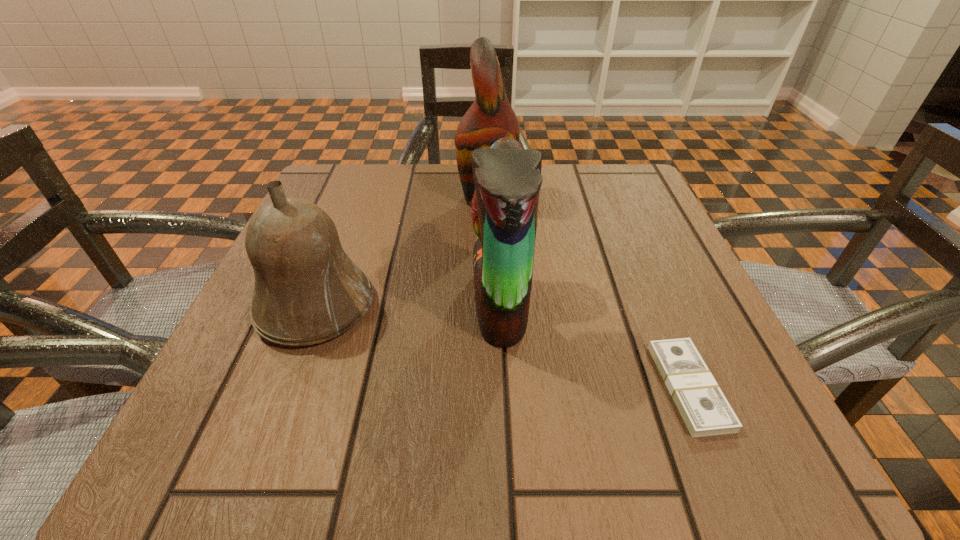
This screenshot has height=540, width=960. I want to click on vacant space that is in between the shorter parrot and the leftmost object, so click(x=408, y=305).

You are a GUI agent. You are given a task and a screenshot of the screen. Output one action in this format:
    pyautogui.click(x=<x>, y=<y>)
    Task: Click on the vacant area that lies between the dollar and the farthest object
    This screenshot has width=960, height=540.
    Given the screenshot: What is the action you would take?
    pyautogui.click(x=589, y=292)

Image resolution: width=960 pixels, height=540 pixels. I want to click on free point between the bell and the farthest object, so click(403, 252).

The width and height of the screenshot is (960, 540). Find the location of `object that is the third closest to the shortest object`. object that is the third closest to the shortest object is located at coordinates (307, 290).

Locate an element on the screen. object that is the closest to the nearer parrot is located at coordinates (491, 117).

I want to click on free spot that satisfies the following two spatial constraints: 1. on the face of the shortest object; 2. on the right side of the farthest object, so click(497, 387).

The width and height of the screenshot is (960, 540). I want to click on vacant space that satisfies the following two spatial constraints: 1. at the face of the nearer parrot; 2. on the front side of the leftmost object, so click(x=500, y=306).

This screenshot has height=540, width=960. Identify the location of free spot that satisfies the following two spatial constraints: 1. on the face of the farthest object; 2. on the front side of the third tallest object. (494, 306).

You are a GUI agent. You are given a task and a screenshot of the screen. Output one action in this format:
    pyautogui.click(x=<x>, y=<y>)
    Task: Click on the free space that satisfies the following two spatial constraints: 1. at the face of the second tallest object; 2. on the back side of the rightmost object
    This screenshot has width=960, height=540.
    Given the screenshot: What is the action you would take?
    pyautogui.click(x=504, y=387)

Locate an element on the screen. This screenshot has width=960, height=540. free space that satisfies the following two spatial constraints: 1. on the back side of the shortest object; 2. at the face of the third shortest object is located at coordinates pyautogui.click(x=655, y=303).